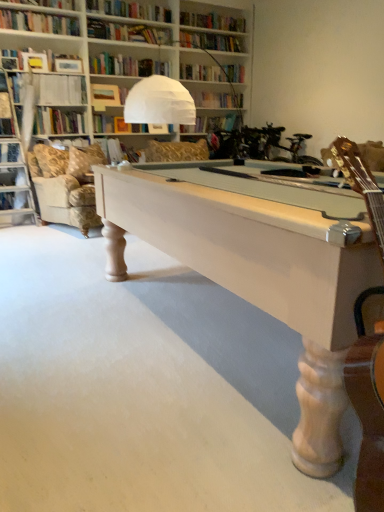
Question: In terms of width, does white wood pool table at center look wider or thinner when compared to matte brown book at upper center, positioned as the third book in bottom-to-top order?

Choices:
 (A) thin
 (B) wide

Answer: (B)

Question: Would you say white wood pool table at center is to the left or to the right of matte brown book at upper center, positioned as the third book in bottom-to-top order, in the picture?

Choices:
 (A) right
 (B) left

Answer: (A)

Question: Estimate the real-world distances between objects in this image. Which object is closer to the beige fabric pillow at left?

Choices:
 (A) white paper at upper left, arranged as the second book when ordered from the bottom
 (B) shiny gold guitar at right
 (C) white wood pool table at center
 (D) velvet gold swivel chair at upper left
 (E) matte brown book at upper center, positioned as the third book in bottom-to-top order

Answer: (D)

Question: Which object is the farthest from the matte brown book at upper center, which is counted as the first book, starting from the top?

Choices:
 (A) white paper at upper left, the second book in the top-to-bottom sequence
 (B) beige fabric pillow at left
 (C) velvet gold swivel chair at upper left
 (D) light beige fabric couch at left
 (E) white paper book at upper center, positioned as the 3th book in top-to-bottom order

Answer: (C)